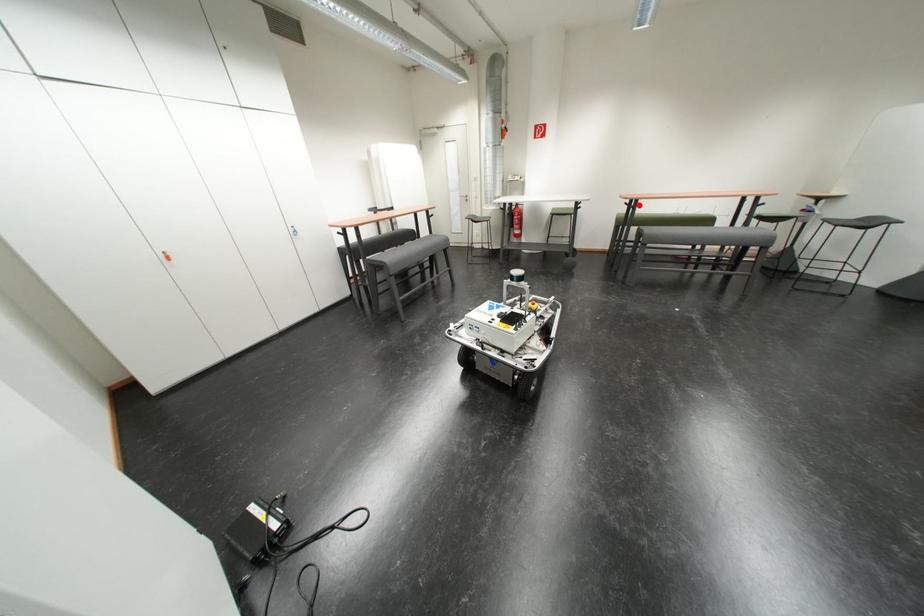
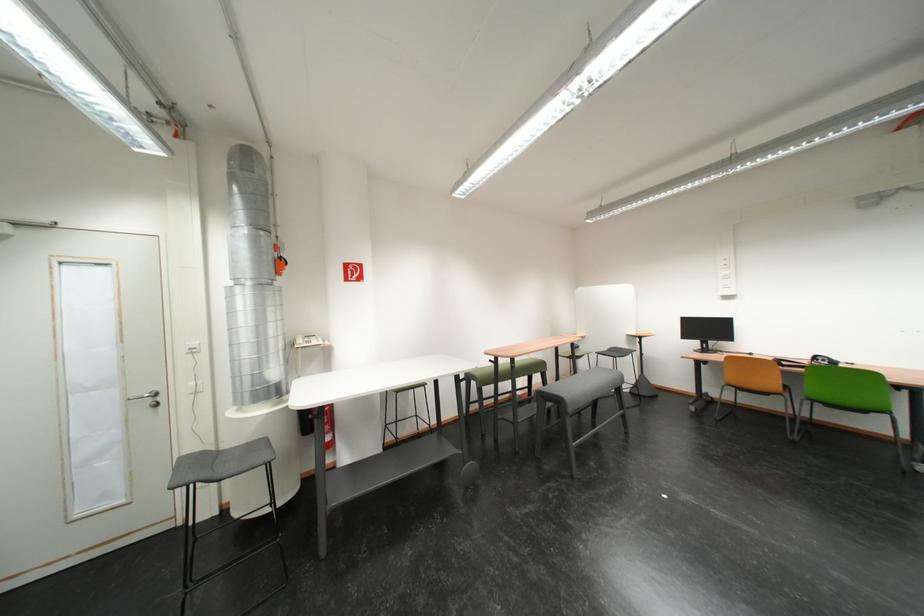
Question: I am providing you with two images of the same scene from different viewpoints. Given a red point in image1, look at the same physical point in image2. Is it:

Choices:
 (A) Closer to the viewpoint
 (B) Farther from the viewpoint

Answer: (B)